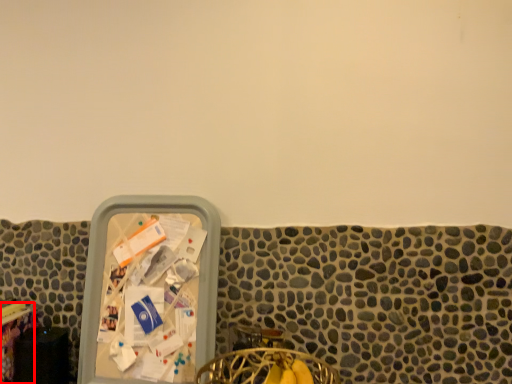
Question: Where is table (annotated by the red box) located in relation to chair in the image?

Choices:
 (A) left
 (B) right

Answer: (A)